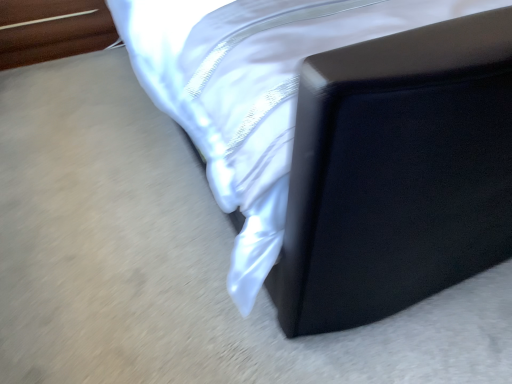
Question: Considering the relative sizes of wooden toothpick at upper left, which ranks as the first furniture in left-to-right order, and matte black bed frame at upper right, the first furniture in the right-to-left sequence, in the image provided, is wooden toothpick at upper left, which ranks as the first furniture in left-to-right order, taller than matte black bed frame at upper right, the first furniture in the right-to-left sequence,?

Choices:
 (A) yes
 (B) no

Answer: (B)

Question: Does wooden toothpick at upper left, acting as the second furniture starting from the right, have a lesser width compared to matte black bed frame at upper right, the first furniture in the right-to-left sequence?

Choices:
 (A) yes
 (B) no

Answer: (A)

Question: Is wooden toothpick at upper left, which ranks as the first furniture in left-to-right order, facing towards matte black bed frame at upper right, the first furniture in the right-to-left sequence?

Choices:
 (A) no
 (B) yes

Answer: (A)

Question: Considering the relative sizes of wooden toothpick at upper left, which ranks as the first furniture in left-to-right order, and matte black bed frame at upper right, the first furniture in the right-to-left sequence, in the image provided, is wooden toothpick at upper left, which ranks as the first furniture in left-to-right order, wider than matte black bed frame at upper right, the first furniture in the right-to-left sequence,?

Choices:
 (A) no
 (B) yes

Answer: (A)

Question: From the image's perspective, would you say wooden toothpick at upper left, acting as the second furniture starting from the right, is positioned over matte black bed frame at upper right, the first furniture in the right-to-left sequence?

Choices:
 (A) yes
 (B) no

Answer: (B)

Question: Can you confirm if wooden toothpick at upper left, which ranks as the first furniture in left-to-right order, is shorter than matte black bed frame at upper right, acting as the second furniture starting from the left?

Choices:
 (A) no
 (B) yes

Answer: (B)

Question: Does matte black bed frame at upper right, the first furniture in the right-to-left sequence, have a larger size compared to wooden toothpick at upper left, acting as the second furniture starting from the right?

Choices:
 (A) no
 (B) yes

Answer: (B)

Question: Does matte black bed frame at upper right, the first furniture in the right-to-left sequence, have a greater height compared to wooden toothpick at upper left, which ranks as the first furniture in left-to-right order?

Choices:
 (A) no
 (B) yes

Answer: (B)

Question: Is wooden toothpick at upper left, acting as the second furniture starting from the right, located within matte black bed frame at upper right, the first furniture in the right-to-left sequence?

Choices:
 (A) no
 (B) yes

Answer: (A)

Question: Does matte black bed frame at upper right, the first furniture in the right-to-left sequence, appear on the left side of wooden toothpick at upper left, acting as the second furniture starting from the right?

Choices:
 (A) yes
 (B) no

Answer: (B)

Question: From a real-world perspective, is matte black bed frame at upper right, acting as the second furniture starting from the left, positioned under wooden toothpick at upper left, acting as the second furniture starting from the right, based on gravity?

Choices:
 (A) no
 (B) yes

Answer: (A)

Question: Is matte black bed frame at upper right, acting as the second furniture starting from the left, looking in the opposite direction of wooden toothpick at upper left, which ranks as the first furniture in left-to-right order?

Choices:
 (A) yes
 (B) no

Answer: (B)

Question: Is matte black bed frame at upper right, the first furniture in the right-to-left sequence, to the left or to the right of wooden toothpick at upper left, acting as the second furniture starting from the right, in the image?

Choices:
 (A) right
 (B) left

Answer: (A)